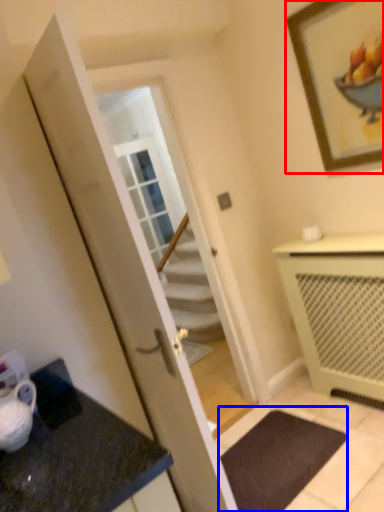
Question: Which of the following is the closest to the observer, picture frame (highlighted by a red box) or bath mat (highlighted by a blue box)?

Choices:
 (A) picture frame
 (B) bath mat

Answer: (A)